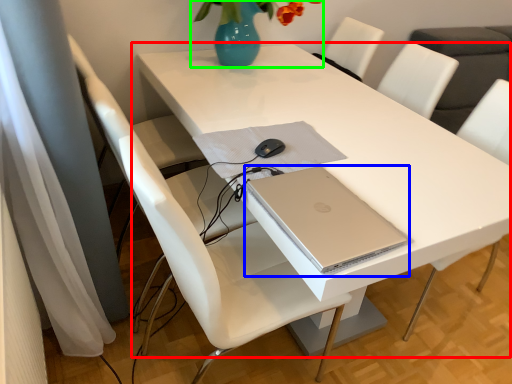
Question: Estimate the real-world distances between objects in this image. Which object is farther from table (highlighted by a red box), computer (highlighted by a blue box) or floral arrangement (highlighted by a green box)?

Choices:
 (A) computer
 (B) floral arrangement

Answer: (B)